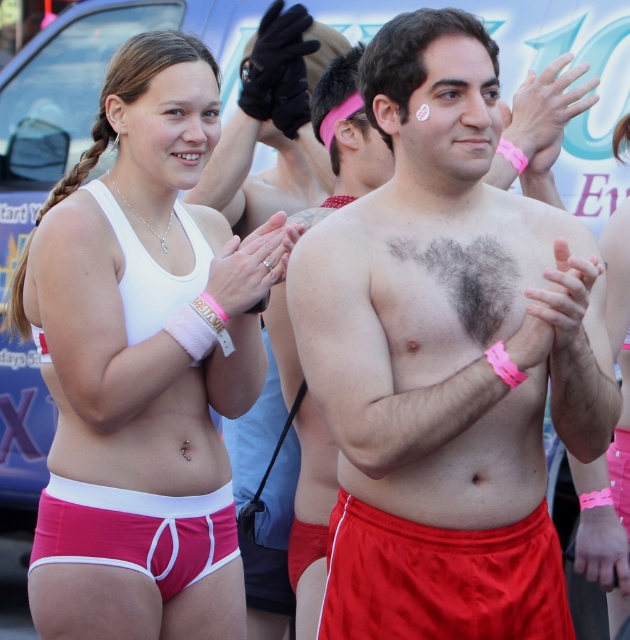
You are organizing a charity event and need to ensure all participants have appropriate attire. You notice the matte red shorts at lower center and the pink fabric underwear at lower left. Which item of clothing is wider?

The matte red shorts at lower center might be wider than pink fabric underwear at lower left according to the description.

You are a photographer at the event and want to capture a photo of the smooth skin chest at center without the pink fabric underwear at lower left appearing in the background. Is this possible?

The smooth skin chest at center is in front of the pink fabric underwear at lower left, so yes, the photographer can capture a photo of the smooth skin chest at center without the pink fabric underwear at lower left appearing in the background.

You are standing at the center of the event and see two points in the distance. The first point is located at coordinates point [346,570] and the second is at point [152,544]. Which point is nearer to you?

Point [346,570] is closer to the viewer than point [152,544], so the first point is nearer to you.